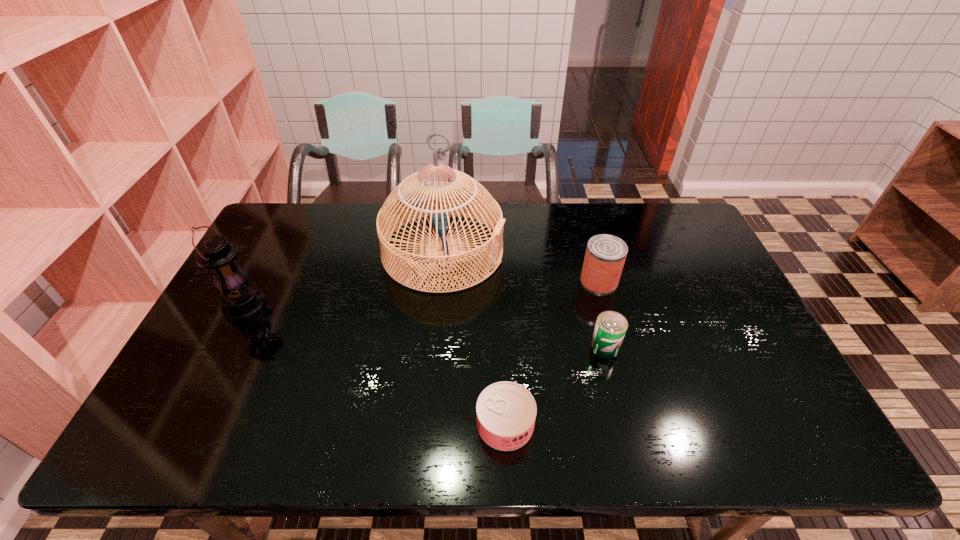
Where is `birdcage`? The height and width of the screenshot is (540, 960). birdcage is located at coordinates (418, 196).

I want to click on lantern, so click(x=240, y=299).

The width and height of the screenshot is (960, 540). In order to click on the leftmost object in this screenshot , I will do `click(240, 299)`.

The width and height of the screenshot is (960, 540). Find the location of `the tallest can`. the tallest can is located at coordinates (605, 256).

Locate an element on the screen. This screenshot has width=960, height=540. the third tallest object is located at coordinates (605, 256).

Identify the location of the second nearest can. (611, 326).

The height and width of the screenshot is (540, 960). Find the location of `the fourth farthest object`. the fourth farthest object is located at coordinates point(611,326).

Find the location of `the nearest object`. the nearest object is located at coordinates (506, 411).

I want to click on the shortest object, so click(x=506, y=411).

The width and height of the screenshot is (960, 540). In order to click on vacant space located 0.330m on the right of the tallest object in this screenshot , I will do `click(604, 251)`.